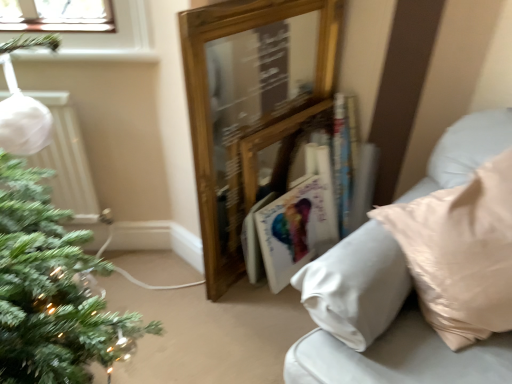
Measure the distance between white glossy magazine at center and camera.

They are 1.64 meters apart.

What do you see at coordinates (379, 323) in the screenshot? The image size is (512, 384). I see `white satin pillow at right` at bounding box center [379, 323].

Identify the location of white glossy magazine at center. The image size is (512, 384). (295, 229).

From a real-world perspective, who is located higher, white glossy magazine at center or white matte radiator at left?

white matte radiator at left.

Could you tell me if white glossy magazine at center is facing white matte radiator at left?

No, white glossy magazine at center is not oriented towards white matte radiator at left.

Are white glossy magazine at center and white matte radiator at left making contact?

No, white glossy magazine at center is not beside white matte radiator at left.

Can you confirm if white glossy magazine at center is wider than white matte radiator at left?

Yes, white glossy magazine at center is wider than white matte radiator at left.

Considering the positions of point (397, 309) and point (318, 230), is point (397, 309) closer or farther from the camera than point (318, 230)?

Point (397, 309) appears to be closer to the viewer than point (318, 230).

Which object is further away from the camera taking this photo, white satin pillow at right or white glossy magazine at center?

Positioned behind is white glossy magazine at center.

Which object is positioned more to the right, white satin pillow at right or white glossy magazine at center?

white satin pillow at right is more to the right.

Considering the relative sizes of hardcover book at center and white matte radiator at left in the image provided, is hardcover book at center smaller than white matte radiator at left?

No.

Considering the sizes of objects hardcover book at center and white matte radiator at left in the image provided, who is wider, hardcover book at center or white matte radiator at left?

With larger width is hardcover book at center.

Is hardcover book at center inside or outside of white matte radiator at left?

hardcover book at center lies outside white matte radiator at left.

Considering the positions of point (255, 282) and point (75, 164), is point (255, 282) closer or farther from the camera than point (75, 164)?

Point (255, 282) is positioned farther from the camera compared to point (75, 164).

Is white satin pillow at right far away from white matte radiator at left?

white satin pillow at right is positioned a significant distance from white matte radiator at left.

I want to click on radiator above the white satin pillow at right (from the image's perspective), so click(x=67, y=160).

Consider the image. Is white matte radiator at left at the back of white satin pillow at right?

No, white satin pillow at right is not facing the opposite direction of white matte radiator at left.

Is white satin pillow at right completely or partially outside of white matte radiator at left?

white satin pillow at right is positioned outside white matte radiator at left.

Which is behind, point (87, 182) or point (335, 255)?

Point (87, 182)

Between white matte radiator at left and white satin pillow at right, which one has larger size?

Bigger between the two is white satin pillow at right.

Is white matte radiator at left positioned beyond the bounds of white satin pillow at right?

white matte radiator at left lies outside white satin pillow at right's area.

Which object is closer to the camera taking this photo, white matte radiator at left or white satin pillow at right?

white satin pillow at right is in front.

Would you say hardcover book at center is a long distance from white glossy magazine at center?

No, hardcover book at center is not far away from white glossy magazine at center.

From a real-world perspective, does hardcover book at center sit lower than white glossy magazine at center?

Incorrect, from a real-world perspective, hardcover book at center is higher than white glossy magazine at center.

How many degrees apart are the facing directions of hardcover book at center and white glossy magazine at center?

The angle between the facing direction of hardcover book at center and the facing direction of white glossy magazine at center is 0.753 degrees.

From the image's perspective, is hardcover book at center below white glossy magazine at center?

Incorrect, from the image's perspective, hardcover book at center is higher than white glossy magazine at center.

Does white glossy magazine at center contain white satin pillow at right?

No, white satin pillow at right is located outside of white glossy magazine at center.

Based on their positions, is white glossy magazine at center located to the left or right of white satin pillow at right?

white glossy magazine at center is positioned on white satin pillow at right's left side.

Is point (289, 203) positioned before point (411, 195)?

That is False.

Identify the location of radiator above the white glossy magazine at center (from the image's perspective). click(67, 160).

Find the location of a particular element. This screenshot has width=512, height=384. magazine on the left of white satin pillow at right is located at coordinates (295, 229).

From the picture: Based on their spatial positions, is hardcover book at center or white glossy magazine at center further from white matte radiator at left?

white glossy magazine at center is positioned further to the anchor white matte radiator at left.

From the image, which object appears to be nearer to white glossy magazine at center, white matte radiator at left or white satin pillow at right?

white satin pillow at right is positioned closer to the anchor white glossy magazine at center.

When comparing their distances from white glossy magazine at center, does white satin pillow at right or white matte radiator at left seem closer?

white satin pillow at right.

When comparing their distances from white satin pillow at right, does white matte radiator at left or white glossy magazine at center seem further?

Based on the image, white matte radiator at left appears to be further to white satin pillow at right.

Based on their spatial positions, is white satin pillow at right or white glossy magazine at center closer to hardcover book at center?

white glossy magazine at center is positioned closer to the anchor hardcover book at center.

Which object lies further to the anchor point white satin pillow at right, white glossy magazine at center or hardcover book at center?

hardcover book at center is positioned further to the anchor white satin pillow at right.

When comparing their distances from hardcover book at center, does white matte radiator at left or white satin pillow at right seem further?

white matte radiator at left lies further to hardcover book at center than the other object.

Estimate the real-world distances between objects in this image. Which object is closer to white satin pillow at right, white matte radiator at left or hardcover book at center?

Based on the image, hardcover book at center appears to be nearer to white satin pillow at right.

I want to click on book between white matte radiator at left and white glossy magazine at center in the horizontal direction, so click(281, 184).

Locate an element on the screen. This screenshot has width=512, height=384. book positioned between white satin pillow at right and white glossy magazine at center from near to far is located at coordinates (281, 184).

Find the location of a particular element. The height and width of the screenshot is (384, 512). magazine between white matte radiator at left and white satin pillow at right from left to right is located at coordinates (295, 229).

I want to click on book located between white matte radiator at left and white satin pillow at right in the left-right direction, so click(x=281, y=184).